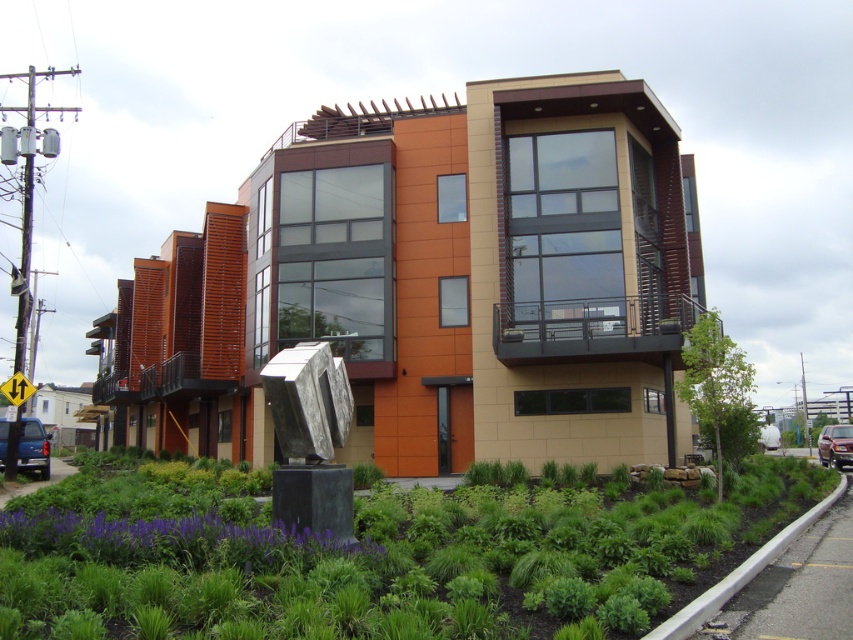
Which is below, green leafy plant at center or matte blue truck at lower left?

Positioned lower is matte blue truck at lower left.

In the scene shown: Is green leafy plant at center shorter than matte blue truck at lower left?

No, green leafy plant at center is not shorter than matte blue truck at lower left.

Locate an element on the screen. This screenshot has width=853, height=640. green leafy plant at center is located at coordinates (375, 556).

Does white concrete curb at lower right have a greater width compared to shiny black sedan at lower right?

Yes, white concrete curb at lower right is wider than shiny black sedan at lower right.

Is white concrete curb at lower right behind shiny black sedan at lower right?

No, white concrete curb at lower right is in front of shiny black sedan at lower right.

Does point (750, 576) come farther from viewer compared to point (833, 438)?

No, (750, 576) is closer to viewer.

Locate an element on the screen. This screenshot has height=640, width=853. white concrete curb at lower right is located at coordinates (738, 576).

You are a GUI agent. You are given a task and a screenshot of the screen. Output one action in this format:
    pyautogui.click(x=<x>, y=<y>)
    Task: Click on the green leafy plant at center
    The width and height of the screenshot is (853, 640).
    Given the screenshot: What is the action you would take?
    pyautogui.click(x=375, y=556)

Find the location of `green leafy plant at center`. green leafy plant at center is located at coordinates (375, 556).

Where is `green leafy plant at center`? The width and height of the screenshot is (853, 640). green leafy plant at center is located at coordinates (375, 556).